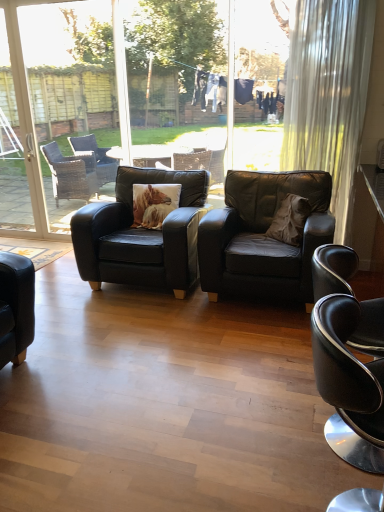
Where is `space that is in front of matte black armchair at center, marked as the third chair in a front-to-back arrangement`? space that is in front of matte black armchair at center, marked as the third chair in a front-to-back arrangement is located at coordinates (144, 331).